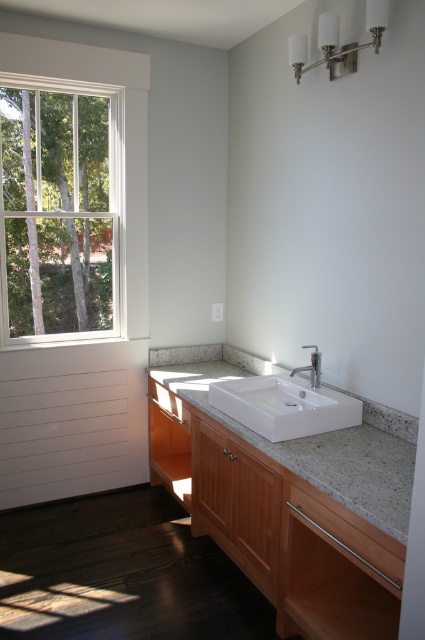
Is granite countertop at center above satin nickel faucet at center?

No.

Is granite countertop at center wider than satin nickel faucet at center?

Indeed, granite countertop at center has a greater width compared to satin nickel faucet at center.

Does point (183, 369) lie in front of point (311, 346)?

No, it is behind (311, 346).

Where is `granite countertop at center`? Image resolution: width=425 pixels, height=640 pixels. granite countertop at center is located at coordinates (311, 436).

Which is above, white wood window at left or white ceramic sink at center?

white wood window at left is higher up.

Is point (11, 237) farther from viewer compared to point (255, 406)?

Yes, it is behind point (255, 406).

Identify the location of white wood window at left. (59, 211).

Which of these two, white wood window at left or satin nickel faucet at center, stands shorter?

satin nickel faucet at center is shorter.

Is white wood window at left wider than satin nickel faucet at center?

Yes, white wood window at left is wider than satin nickel faucet at center.

Between point (62, 284) and point (312, 384), which one is positioned behind?

Positioned behind is point (62, 284).

Identify the location of white wood window at left. (59, 211).